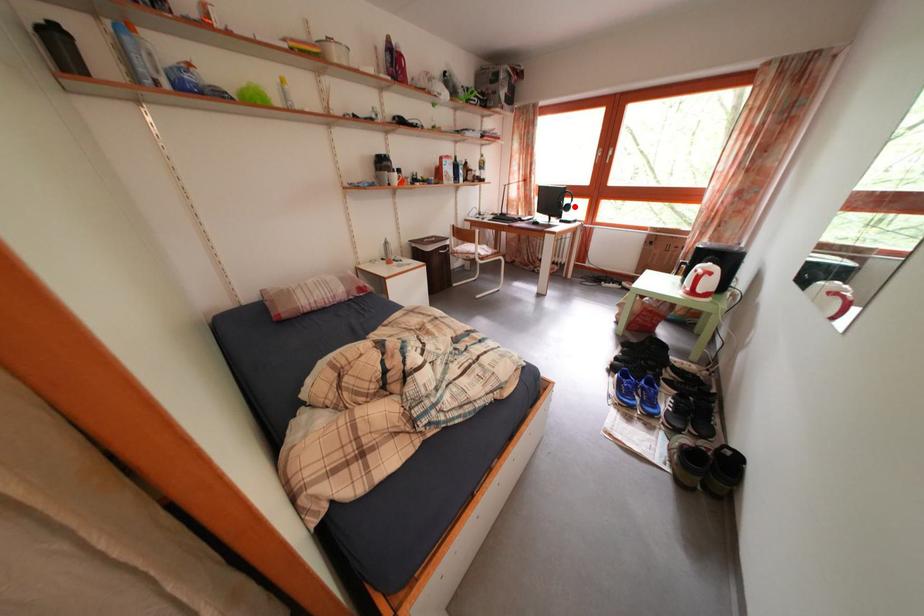
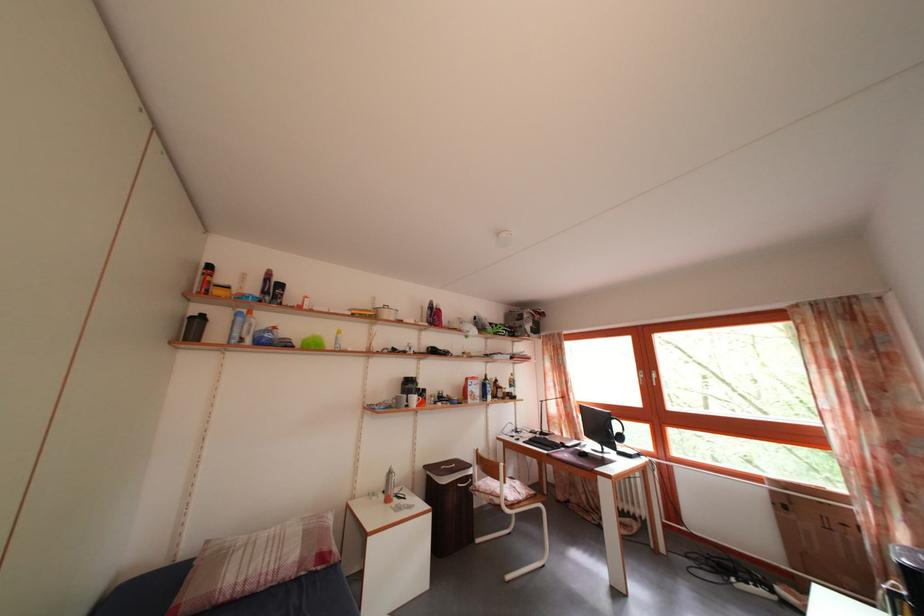
Question: I am providing you with two images of the same scene from different viewpoints. Given a red point in image1, look at the same physical point in image2. Is it:

Choices:
 (A) Closer to the viewpoint
 (B) Farther from the viewpoint

Answer: (B)